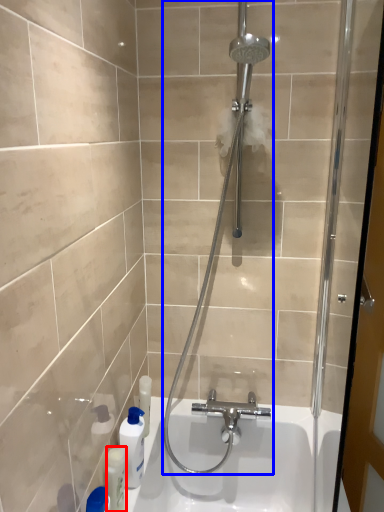
Question: Which point is closer to the camera, toiletry (highlighted by a red box) or shower (highlighted by a blue box)?

Choices:
 (A) toiletry
 (B) shower

Answer: (B)